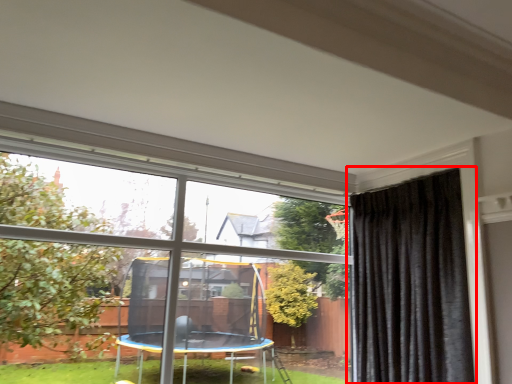
Question: From the image's perspective, where is curtain (annotated by the red box) located relative to window?

Choices:
 (A) below
 (B) above

Answer: (A)